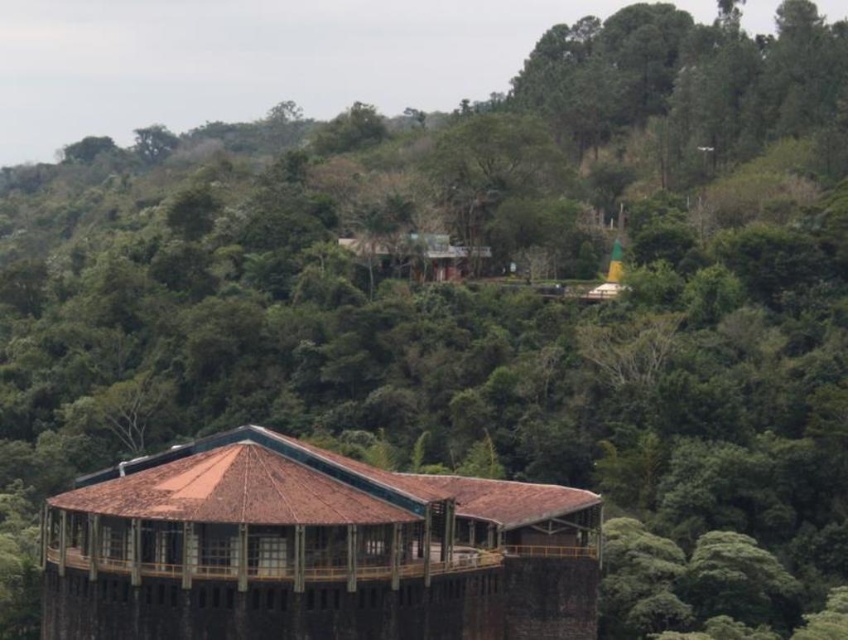
You are planning to host a small gathering and need to choose between the brown wooden gazebo at center and the brown wooden hut at center for more space. Which one should you choose?

The brown wooden gazebo at center has a larger width than the brown wooden hut at center, so you should choose the brown wooden gazebo at center for more space.

You are standing in a forest and see both the brown wooden gazebo at center and the brown wooden hut at center. Which structure is nearer to you?

The brown wooden gazebo at center is closer to the viewer than the brown wooden hut at center, so the gazebo is nearer.